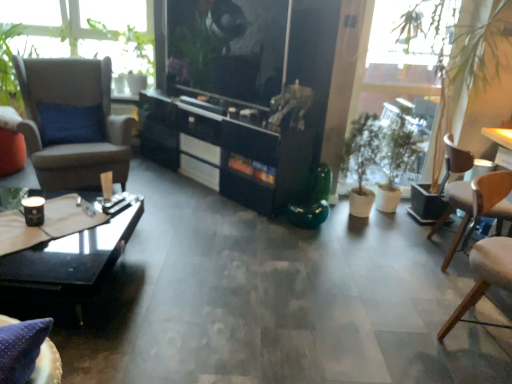
Question: Is brown leather armchair at left, placed as the 2th chair when sorted from right to left, positioned far away from green matte plant at right?

Choices:
 (A) no
 (B) yes

Answer: (B)

Question: From the image's perspective, does brown leather armchair at left, which appears as the 1th chair when viewed from the left, appear higher than green matte plant at right?

Choices:
 (A) yes
 (B) no

Answer: (A)

Question: Considering the relative sizes of brown leather armchair at left, placed as the 2th chair when sorted from right to left, and green matte plant at right in the image provided, is brown leather armchair at left, placed as the 2th chair when sorted from right to left, thinner than green matte plant at right?

Choices:
 (A) yes
 (B) no

Answer: (B)

Question: From a real-world perspective, is brown leather armchair at left, placed as the 2th chair when sorted from right to left, below green matte plant at right?

Choices:
 (A) yes
 (B) no

Answer: (B)

Question: Is brown leather armchair at left, which appears as the 1th chair when viewed from the left, bigger than green matte plant at right?

Choices:
 (A) no
 (B) yes

Answer: (B)

Question: Is brown leather armchair at left, placed as the 2th chair when sorted from right to left, oriented away from green matte plant at right?

Choices:
 (A) no
 (B) yes

Answer: (A)

Question: Is black glossy cabinet at center taller than green matte plant at right?

Choices:
 (A) no
 (B) yes

Answer: (A)

Question: Is black glossy cabinet at center positioned with its back to green matte plant at right?

Choices:
 (A) yes
 (B) no

Answer: (B)

Question: Can you confirm if black glossy cabinet at center is shorter than green matte plant at right?

Choices:
 (A) yes
 (B) no

Answer: (A)

Question: Is black glossy cabinet at center positioned before green matte plant at right?

Choices:
 (A) yes
 (B) no

Answer: (A)

Question: Does black glossy cabinet at center appear on the right side of green matte plant at right?

Choices:
 (A) no
 (B) yes

Answer: (A)

Question: From a real-world perspective, is black glossy cabinet at center physically below green matte plant at right?

Choices:
 (A) no
 (B) yes

Answer: (B)

Question: Is wooden table at right taller than black glossy cabinet at center?

Choices:
 (A) no
 (B) yes

Answer: (B)